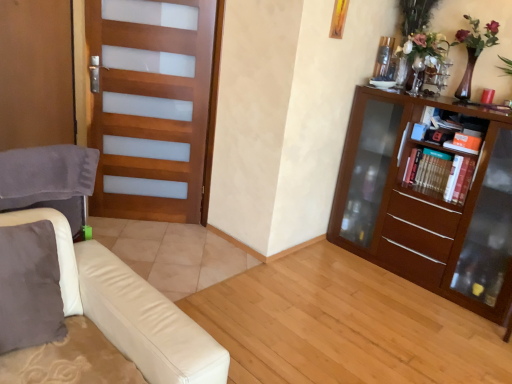
Question: Is hardcover books at right taller or shorter than brown wooden bookcase at right?

Choices:
 (A) tall
 (B) short

Answer: (B)

Question: From a real-world perspective, is hardcover books at right positioned above or below brown wooden bookcase at right?

Choices:
 (A) above
 (B) below

Answer: (A)

Question: Considering the real-world distances, which object is farthest from the wooden bookshelf at right?

Choices:
 (A) velvet gray swivel chair at left
 (B) wooden door at left
 (C) hardcover books at right
 (D) brown wooden bookcase at right
 (E) wooden screen door at left

Answer: (E)

Question: Estimate the real-world distances between objects in this image. Which object is closer to the velvet gray swivel chair at left?

Choices:
 (A) hardcover books at right
 (B) wooden bookshelf at right
 (C) wooden door at left
 (D) brown wooden bookcase at right
 (E) wooden screen door at left

Answer: (C)